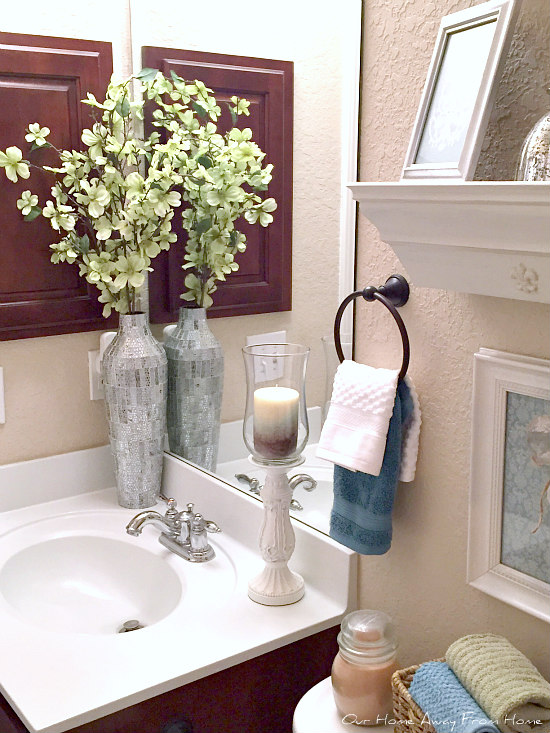
At what (x,y) coordinates should I click in order to perform the action: click on counter top. Please return your answer as a coordinate pair (x, y). The width and height of the screenshot is (550, 733). Looking at the image, I should click on (55, 690), (221, 641), (9, 520).